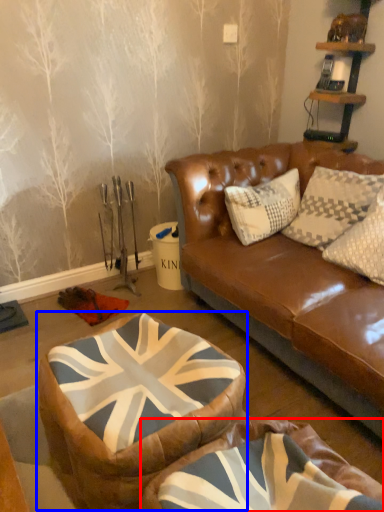
Question: Which object appears farthest to the camera in this image, bean bag chair (highlighted by a red box) or bean bag chair (highlighted by a blue box)?

Choices:
 (A) bean bag chair
 (B) bean bag chair

Answer: (B)